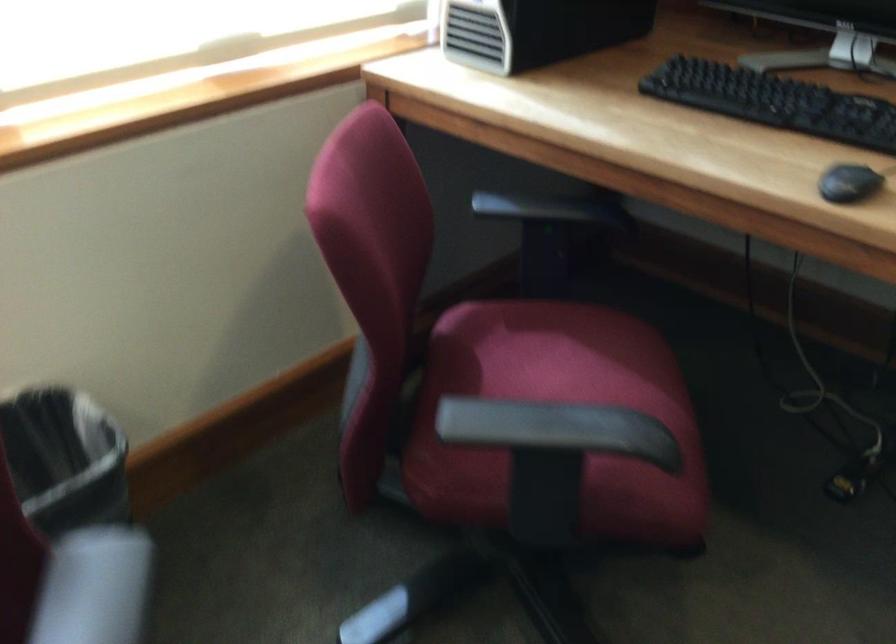
Image resolution: width=896 pixels, height=644 pixels. In order to click on black computer mouse in this screenshot , I will do `click(848, 183)`.